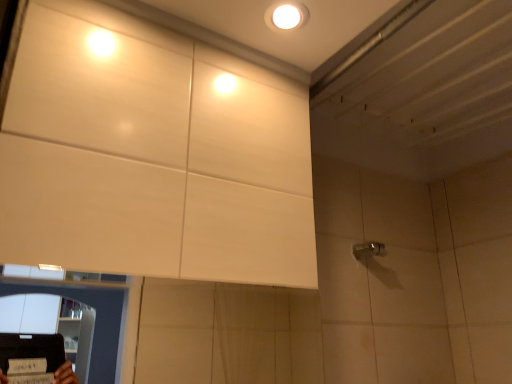
Question: Choose the correct answer: Is white glossy droplight at upper center inside satin nickel faucet at right or outside it?

Choices:
 (A) outside
 (B) inside

Answer: (A)

Question: Relative to satin nickel faucet at right, is white glossy droplight at upper center in front or behind?

Choices:
 (A) front
 (B) behind

Answer: (A)

Question: Based on their sizes in the image, would you say white glossy droplight at upper center is bigger or smaller than satin nickel faucet at right?

Choices:
 (A) small
 (B) big

Answer: (A)

Question: Is point (364, 241) closer or farther from the camera than point (301, 18)?

Choices:
 (A) farther
 (B) closer

Answer: (A)

Question: Looking at their shapes, would you say satin nickel faucet at right is wider or thinner than white glossy droplight at upper center?

Choices:
 (A) thin
 (B) wide

Answer: (A)

Question: Is satin nickel faucet at right taller or shorter than white glossy droplight at upper center?

Choices:
 (A) short
 (B) tall

Answer: (B)

Question: Would you say satin nickel faucet at right is inside or outside white glossy droplight at upper center?

Choices:
 (A) outside
 (B) inside

Answer: (A)